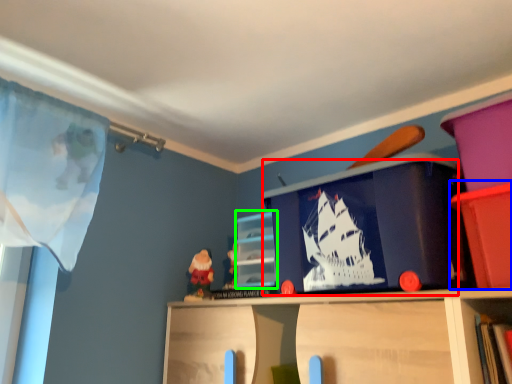
Question: Considering the real-world distances, which object is farthest from window screen (highlighted by a red box)? cabinet (highlighted by a blue box) or cabinet (highlighted by a green box)?

Choices:
 (A) cabinet
 (B) cabinet

Answer: (B)